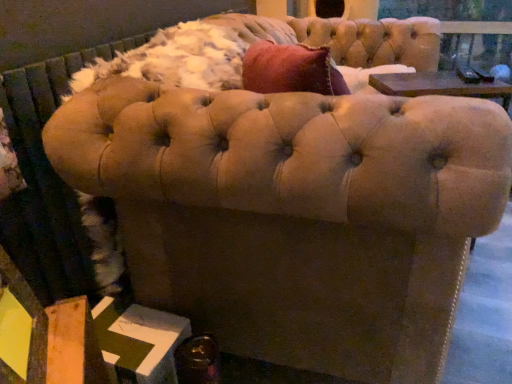
Question: Considering the positions of shiny metallic bottle at lower left and velvet beige sofa at center in the image, is shiny metallic bottle at lower left bigger or smaller than velvet beige sofa at center?

Choices:
 (A) small
 (B) big

Answer: (A)

Question: Do you think shiny metallic bottle at lower left is within velvet beige sofa at center, or outside of it?

Choices:
 (A) outside
 (B) inside

Answer: (A)

Question: Is shiny metallic bottle at lower left wider or thinner than velvet beige sofa at center?

Choices:
 (A) thin
 (B) wide

Answer: (A)

Question: Would you say velvet beige sofa at center is to the left or to the right of shiny metallic bottle at lower left in the picture?

Choices:
 (A) right
 (B) left

Answer: (A)

Question: Is velvet beige sofa at center wider or thinner than shiny metallic bottle at lower left?

Choices:
 (A) thin
 (B) wide

Answer: (B)

Question: From a real-world perspective, relative to shiny metallic bottle at lower left, is velvet beige sofa at center vertically above or below?

Choices:
 (A) above
 (B) below

Answer: (A)

Question: In terms of size, does velvet beige sofa at center appear bigger or smaller than shiny metallic bottle at lower left?

Choices:
 (A) small
 (B) big

Answer: (B)